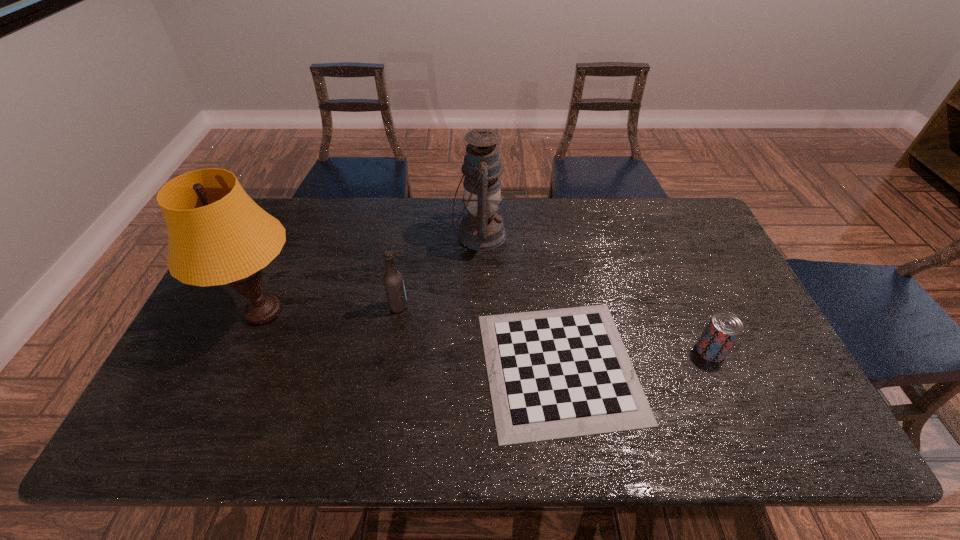
I want to click on free space in the image that satisfies the following two spatial constraints: 1. on the front side of the shortest object; 2. on the right side of the leftmost object, so click(240, 367).

This screenshot has width=960, height=540. I want to click on free space that satisfies the following two spatial constraints: 1. on the front side of the leftmost object; 2. on the left side of the shortest object, so click(x=240, y=367).

Where is `free space that satisfies the following two spatial constraints: 1. on the front side of the second shortest object; 2. on the left side of the farthest object`? This screenshot has width=960, height=540. free space that satisfies the following two spatial constraints: 1. on the front side of the second shortest object; 2. on the left side of the farthest object is located at coordinates (479, 350).

This screenshot has height=540, width=960. I want to click on free space that satisfies the following two spatial constraints: 1. on the label of the beer bottle; 2. on the back side of the beer can, so click(x=392, y=350).

Image resolution: width=960 pixels, height=540 pixels. I want to click on vacant area that satisfies the following two spatial constraints: 1. on the front side of the shortest object; 2. on the right side of the farthest object, so click(x=479, y=367).